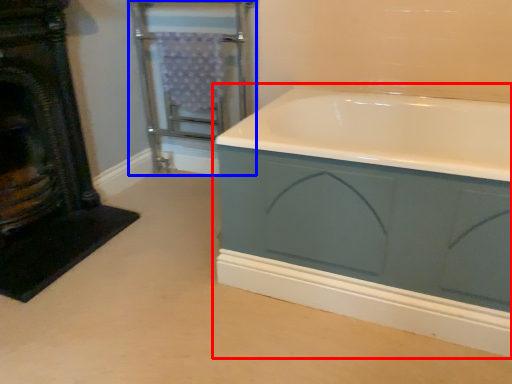
Question: Which of the following is the closest to the observer, bathtub (highlighted by a red box) or screen door (highlighted by a blue box)?

Choices:
 (A) bathtub
 (B) screen door

Answer: (A)